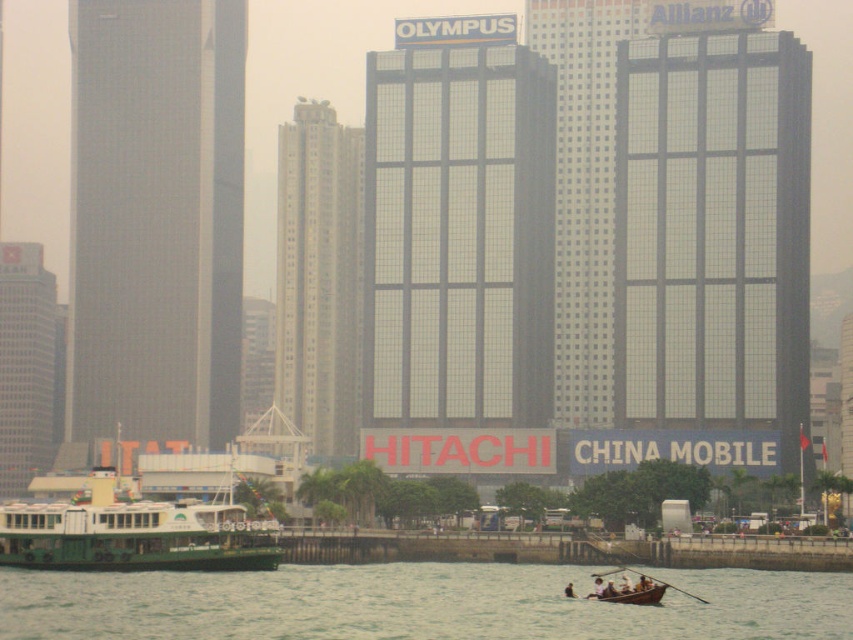
Question: Is green matte ferryboat at lower left wider than wooden at lower right?

Choices:
 (A) no
 (B) yes

Answer: (B)

Question: Which object is farther from the camera taking this photo?

Choices:
 (A) wooden at lower right
 (B) green matte ferryboat at lower left

Answer: (B)

Question: Which point appears closest to the camera in this image?

Choices:
 (A) (161, 541)
 (B) (695, 596)

Answer: (A)

Question: Among these objects, which one is nearest to the camera?

Choices:
 (A) green matte ferryboat at lower left
 (B) green water at lower center

Answer: (B)

Question: From the image, what is the correct spatial relationship of green water at lower center in relation to wooden at lower right?

Choices:
 (A) below
 (B) above

Answer: (B)

Question: Is green water at lower center positioned at the back of wooden canoe at lower center?

Choices:
 (A) yes
 (B) no

Answer: (B)